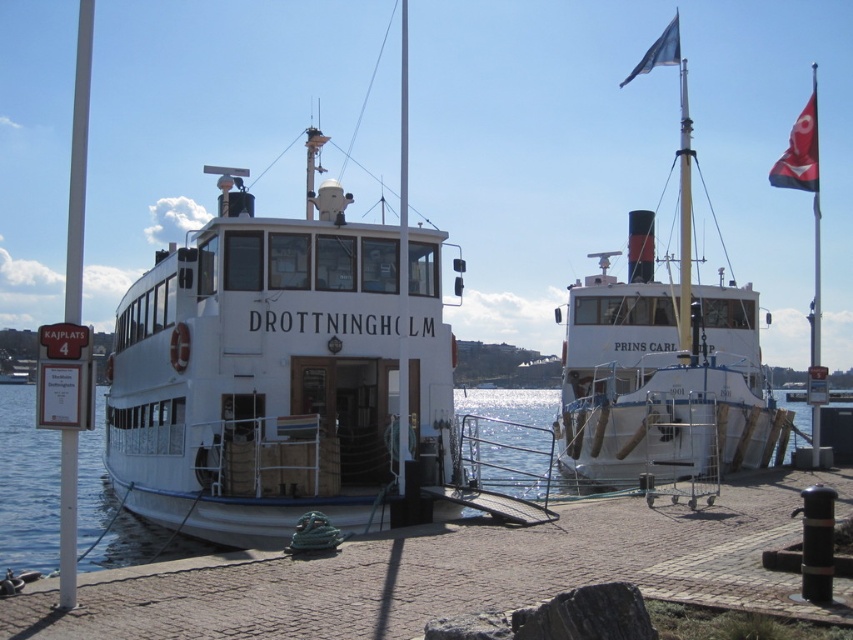
Is point (97, 470) positioned behind point (85, 33)?

No, (97, 470) is closer to viewer.

The image size is (853, 640). Describe the element at coordinates (26, 484) in the screenshot. I see `clear water at center` at that location.

Image resolution: width=853 pixels, height=640 pixels. Identify the location of clear water at center. (26, 484).

Between white matte ferry at center and white matte ship at right, which one is positioned higher?

white matte ship at right is above.

Is point (149, 468) positioned in front of point (646, 436)?

Yes, it is.

Locate an element on the screen. white matte ferry at center is located at coordinates (258, 374).

Which of these two, white matte ferry at center or clear water at center, stands taller?

clear water at center

At what (x,y) coordinates should I click in order to perform the action: click on white matte ferry at center. Please return your answer as a coordinate pair (x, y). The image size is (853, 640). Looking at the image, I should click on (258, 374).

What are the coordinates of `white matte ferry at center` in the screenshot? It's located at (258, 374).